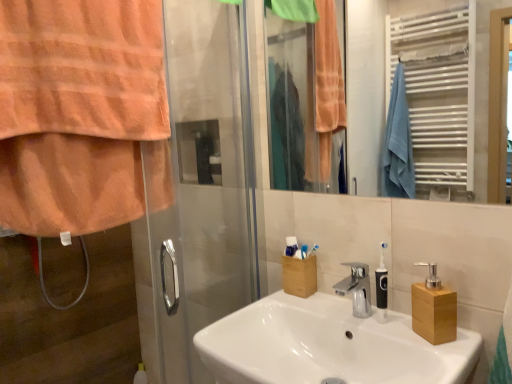
Question: Is orange towel at left wider or thinner than wooden block soap dispenser at right, the 1th soap dispenser when ordered from right to left?

Choices:
 (A) thin
 (B) wide

Answer: (B)

Question: From the image's perspective, is orange towel at left positioned above or below wooden block soap dispenser at right, the 1th soap dispenser when ordered from right to left?

Choices:
 (A) above
 (B) below

Answer: (A)

Question: Based on their relative distances, which object is farther from the orange towel at left?

Choices:
 (A) white ceramic sink at center
 (B) wooden block at right, placed as the 2th soap dispenser when sorted from right to left
 (C) wooden block soap dispenser at right, the 1th soap dispenser when ordered from right to left
 (D) white matte toothbrush holder at center
 (E) metallic silver towel rack at upper right

Answer: (E)

Question: Which object is positioned farthest from the white ceramic sink at center?

Choices:
 (A) orange towel at left
 (B) wooden block soap dispenser at right, the 1th soap dispenser when ordered from right to left
 (C) white matte toothbrush holder at center
 (D) wooden block at right, placed as the first soap dispenser when sorted from left to right
 (E) metallic silver towel rack at upper right

Answer: (E)